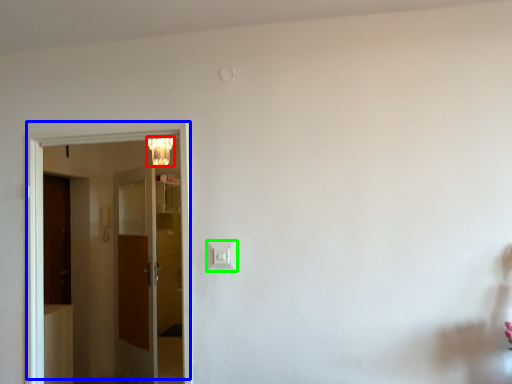
Question: Which object is positioned closest to lamp (highlighted by a red box)? Select from door (highlighted by a blue box) and light switch (highlighted by a green box).

Choices:
 (A) door
 (B) light switch

Answer: (A)